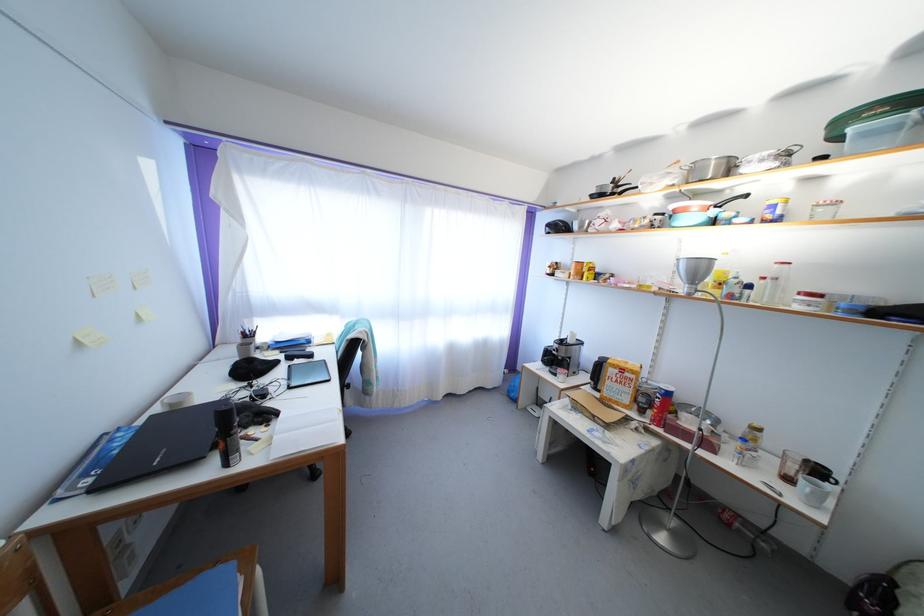
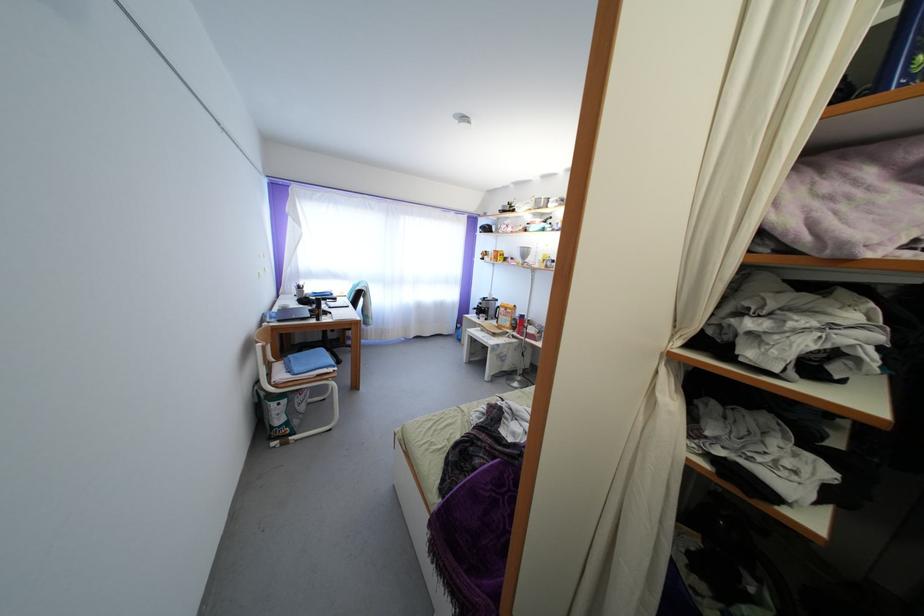
Question: Which direction would the cameraman need to move to produce the second image? Reply with the corresponding letter.

Choices:
 (A) Left
 (B) Right
 (C) Forward
 (D) Backward

Answer: (D)